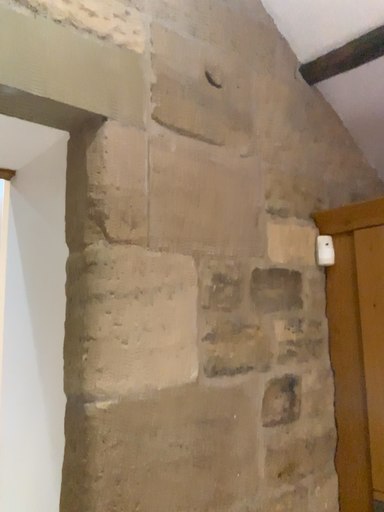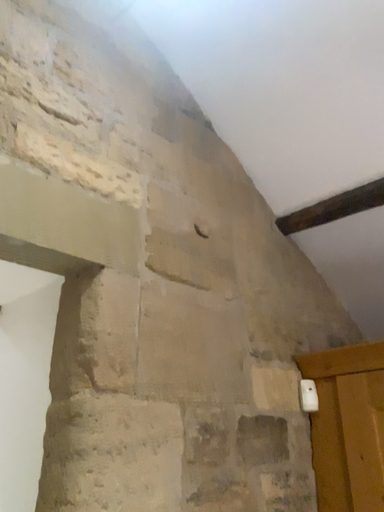
Question: How did the camera likely rotate when shooting the video?

Choices:
 (A) rotated downward
 (B) rotated upward

Answer: (B)